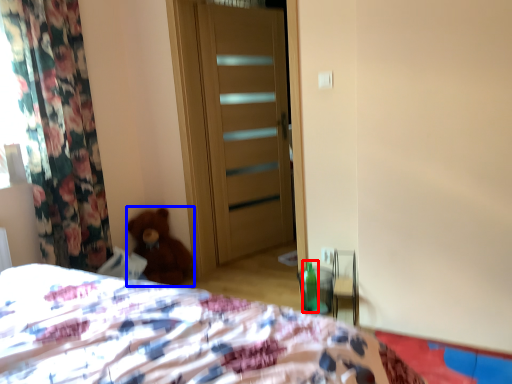
Question: Which object appears closest to the camera in this image, bottle (highlighted by a red box) or teddy bear (highlighted by a blue box)?

Choices:
 (A) bottle
 (B) teddy bear

Answer: (A)